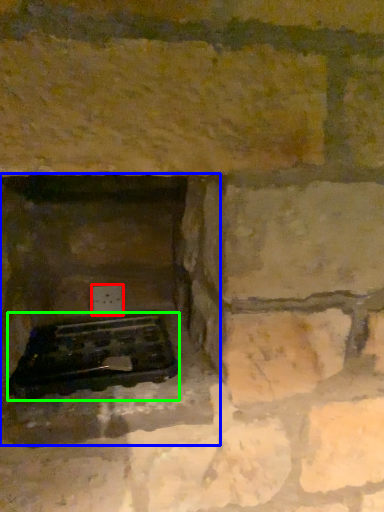
Question: Which object is positioned farthest from electric outlet (highlighted by a red box)? Select from fireplace (highlighted by a blue box) and grill (highlighted by a green box).

Choices:
 (A) fireplace
 (B) grill

Answer: (B)